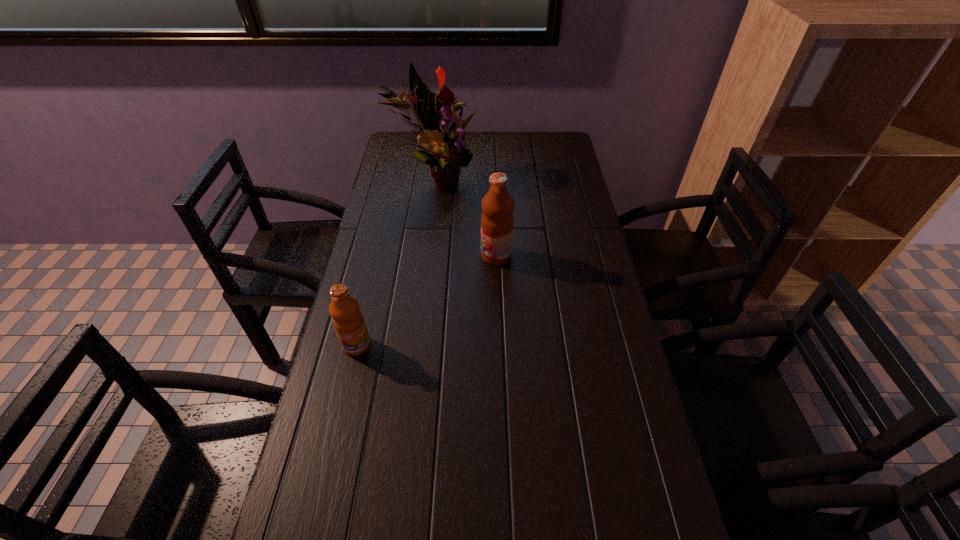
Locate an element on the screen. bouquet is located at coordinates coord(448,154).

Locate an element on the screen. the tallest object is located at coordinates (448, 154).

Locate an element on the screen. This screenshot has width=960, height=540. the farther fruit juice is located at coordinates (497, 222).

Where is `the taller fruit juice`? The image size is (960, 540). the taller fruit juice is located at coordinates (497, 222).

The height and width of the screenshot is (540, 960). In order to click on the left fruit juice in this screenshot , I will do `click(348, 321)`.

This screenshot has height=540, width=960. Identify the location of the nearest object. click(x=348, y=321).

You are a GUI agent. You are given a task and a screenshot of the screen. Output one action in this format:
    pyautogui.click(x=<x>, y=<y>)
    Task: Click on the free spot located 0.200m on the front-facing side of the bouquet
    Image resolution: width=960 pixels, height=540 pixels.
    Given the screenshot: What is the action you would take?
    pyautogui.click(x=534, y=181)

You are a GUI agent. You are given a task and a screenshot of the screen. Output one action in this format:
    pyautogui.click(x=<x>, y=<y>)
    Task: Click on the free location located 0.350m on the front label of the second farthest object
    The height and width of the screenshot is (540, 960).
    Given the screenshot: What is the action you would take?
    [367, 255]

This screenshot has width=960, height=540. Find the location of `free space located 0.180m on the front label of the second farthest object`. free space located 0.180m on the front label of the second farthest object is located at coordinates (422, 255).

This screenshot has width=960, height=540. What are the coordinates of `free space located on the front label of the second farthest object` in the screenshot? It's located at (396, 255).